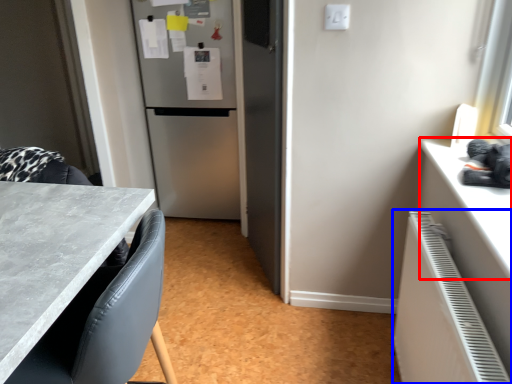
Question: Among these objects, which one is nearest to the camera, counter top (highlighted by a red box) or radiator (highlighted by a blue box)?

Choices:
 (A) counter top
 (B) radiator

Answer: (B)